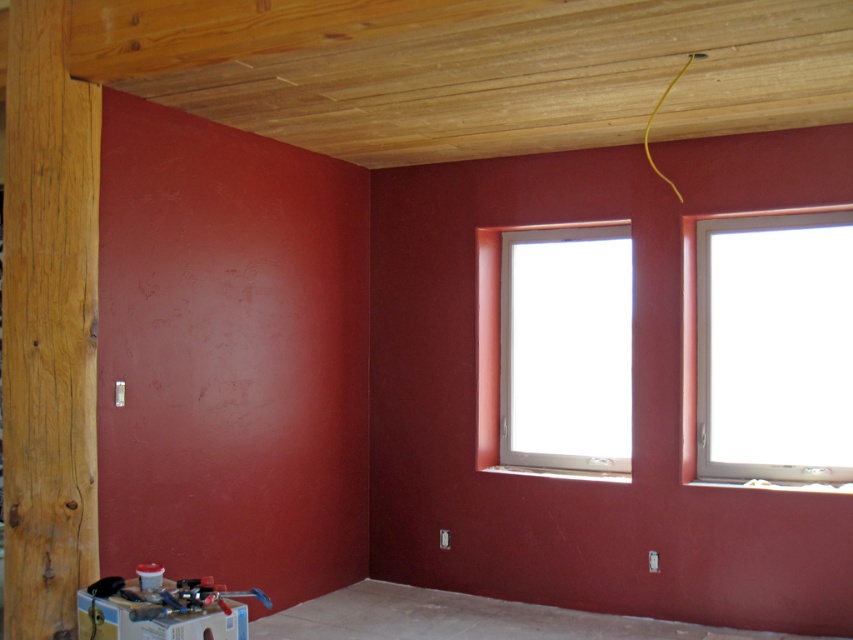
Is the position of white plastic window at upper right more distant than that of white plastic window at center?

No, it is in front of white plastic window at center.

Who is more forward, (750, 246) or (561, 356)?

Point (750, 246)

Is point (788, 435) positioned behind point (502, 396)?

No, it is not.

At what (x,y) coordinates should I click in order to perform the action: click on white plastic window at upper right. Please return your answer as a coordinate pair (x, y). This screenshot has height=640, width=853. Looking at the image, I should click on (775, 348).

Who is taller, natural wood pillar at left or white plastic window at upper right?

With more height is natural wood pillar at left.

Measure the distance between point (15, 93) and camera.

Point (15, 93) and camera are 3.12 meters apart.

Does point (90, 221) lie in front of point (772, 346)?

Yes, point (90, 221) is closer to viewer.

This screenshot has width=853, height=640. I want to click on natural wood pillar at left, so click(49, 324).

Based on the photo, who is positioned more to the left, natural wood pillar at left or white plastic window at center?

From the viewer's perspective, natural wood pillar at left appears more on the left side.

Does natural wood pillar at left appear on the right side of white plastic window at center?

Incorrect, natural wood pillar at left is not on the right side of white plastic window at center.

Between point (28, 177) and point (544, 365), which one is positioned in front?

Point (28, 177) is in front.

At what (x,y) coordinates should I click in order to perform the action: click on natural wood pillar at left. Please return your answer as a coordinate pair (x, y). The width and height of the screenshot is (853, 640). Looking at the image, I should click on (49, 324).